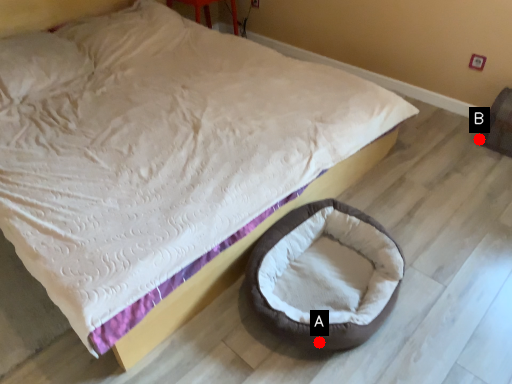
Question: Two points are circled on the image, labeled by A and B beside each circle. Which of the following is the closest to the observer?

Choices:
 (A) A is closer
 (B) B is closer

Answer: (A)